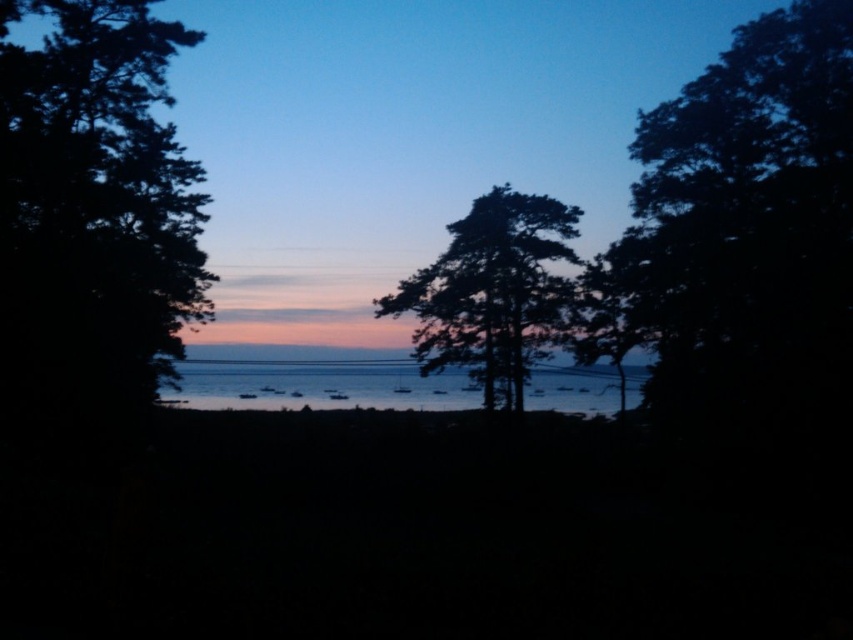
Question: Which point is closer to the camera?

Choices:
 (A) dark green leafy tree at right
 (B) dark green leafy tree at left
 (C) silhouette wood tree at center
 (D) silvery reflective water at center

Answer: (B)

Question: Can you confirm if dark green leafy tree at left is smaller than silhouette wood tree at center?

Choices:
 (A) no
 (B) yes

Answer: (B)

Question: Based on their relative distances, which object is nearer to the silhouette wood tree at center?

Choices:
 (A) silvery reflective water at center
 (B) dark green leafy tree at right

Answer: (B)

Question: Does dark green leafy tree at left appear on the right side of silhouette wood tree at center?

Choices:
 (A) no
 (B) yes

Answer: (A)

Question: Among these points, which one is nearest to the camera?

Choices:
 (A) (805, 412)
 (B) (96, 26)
 (C) (415, 388)

Answer: (B)

Question: Is dark green leafy tree at left further to the viewer compared to silhouette wood tree at center?

Choices:
 (A) no
 (B) yes

Answer: (A)